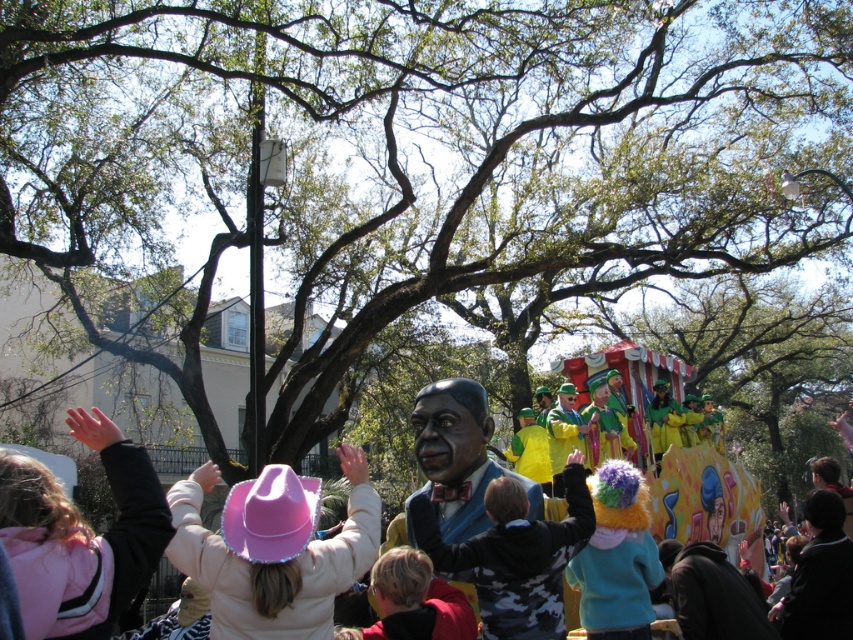
Can you confirm if matte blue suit at center is bigger than fluffy multicolored wig at center?

Yes, matte blue suit at center is bigger than fluffy multicolored wig at center.

The width and height of the screenshot is (853, 640). Identify the location of matte blue suit at center. (471, 500).

At what (x,y) coordinates should I click in order to perform the action: click on matte blue suit at center. Please return your answer as a coordinate pair (x, y). Image resolution: width=853 pixels, height=640 pixels. Looking at the image, I should click on (471, 500).